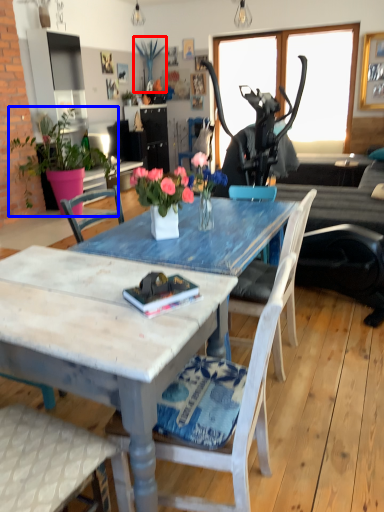
Question: Among these objects, which one is nearest to the camera, plant (highlighted by a red box) or houseplant (highlighted by a blue box)?

Choices:
 (A) plant
 (B) houseplant

Answer: (B)